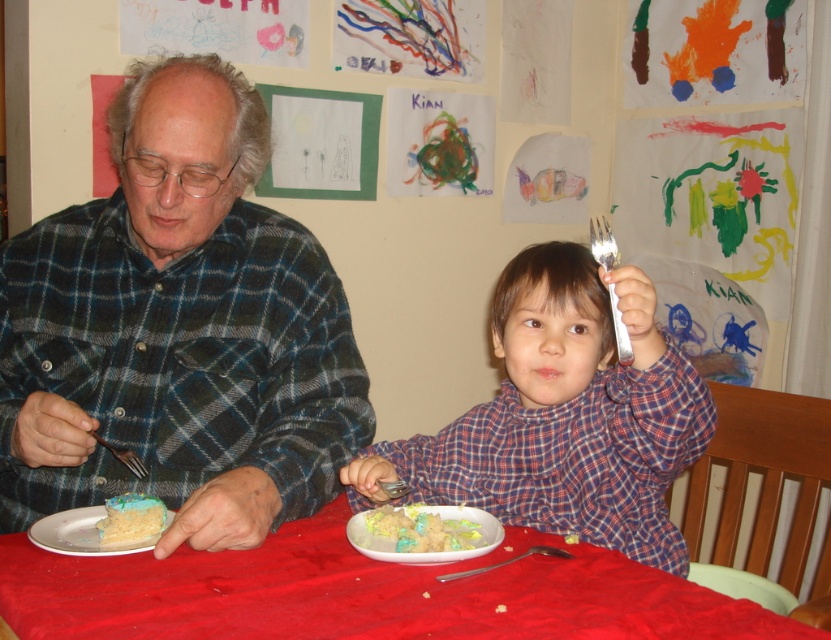
Between matte plaid shirt at left and blue frosted cake at lower left, which one has more height?

matte plaid shirt at left

Does matte plaid shirt at left have a lesser height compared to blue frosted cake at lower left?

No, matte plaid shirt at left is not shorter than blue frosted cake at lower left.

Who is more distant from viewer, (102, 360) or (117, 524)?

The point (102, 360) is behind.

Find the location of a particular element. matte plaid shirt at left is located at coordinates (176, 330).

Is red cloth table at center smaller than pastel frosted cake at lower center?

No, red cloth table at center is not smaller than pastel frosted cake at lower center.

Between red cloth table at center and pastel frosted cake at lower center, which one is positioned higher?

pastel frosted cake at lower center

Is point (480, 621) positioned before point (420, 516)?

Yes, point (480, 621) is closer to viewer.

The width and height of the screenshot is (831, 640). I want to click on red cloth table at center, so click(x=362, y=593).

Can you confirm if blue frosted cake at lower left is thinner than brushed metal fork at left?

Indeed, blue frosted cake at lower left has a lesser width compared to brushed metal fork at left.

Does blue frosted cake at lower left appear over brushed metal fork at left?

Incorrect, blue frosted cake at lower left is not positioned above brushed metal fork at left.

Find the location of a particular element. blue frosted cake at lower left is located at coordinates (x=131, y=518).